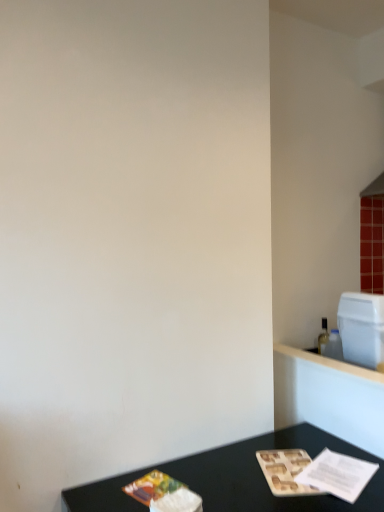
Identify the location of black matte table at lower center. This screenshot has width=384, height=512. (235, 479).

This screenshot has width=384, height=512. What do you see at coordinates (235, 479) in the screenshot? I see `black matte table at lower center` at bounding box center [235, 479].

Describe the element at coordinates (362, 327) in the screenshot. The image size is (384, 512). I see `white plastic container at upper right` at that location.

What is the approximate width of white plastic container at upper right?

29.75 centimeters.

Where is `white plastic container at upper right`? white plastic container at upper right is located at coordinates (362, 327).

At what (x,y) coordinates should I click in order to perform the action: click on black matte table at lower center. Please return your answer as a coordinate pair (x, y). This screenshot has height=512, width=384. Looking at the image, I should click on (235, 479).

Considering the relative positions of black matte table at lower center and white plastic container at upper right in the image provided, is black matte table at lower center to the right of white plastic container at upper right from the viewer's perspective?

Result: Incorrect, black matte table at lower center is not on the right side of white plastic container at upper right.

Considering the relative positions of black matte table at lower center and white plastic container at upper right in the image provided, is black matte table at lower center in front of white plastic container at upper right?

Yes.

Is point (375, 507) closer to viewer compared to point (346, 338)?

Yes, point (375, 507) is closer to viewer.

From the image's perspective, is black matte table at lower center on top of white plastic container at upper right?

No, from the image's perspective, black matte table at lower center is not over white plastic container at upper right.

From a real-world perspective, which is physically above, black matte table at lower center or white plastic container at upper right?

white plastic container at upper right, from a real-world perspective.

Looking at this image, can you confirm if black matte table at lower center is wider than white plastic container at upper right?

Yes, black matte table at lower center is wider than white plastic container at upper right.

Is black matte table at lower center taller or shorter than white plastic container at upper right?

black matte table at lower center is taller than white plastic container at upper right.

In the scene shown: Does black matte table at lower center have a larger size compared to white plastic container at upper right?

Correct, black matte table at lower center is larger in size than white plastic container at upper right.

Is black matte table at lower center located outside white plastic container at upper right?

Yes, black matte table at lower center is not within white plastic container at upper right.

Would you say black matte table at lower center is a long distance from white plastic container at upper right?

That's not correct — black matte table at lower center is a little close to white plastic container at upper right.

Does black matte table at lower center turn towards white plastic container at upper right?

No, black matte table at lower center is not oriented towards white plastic container at upper right.

How many degrees apart are the facing directions of black matte table at lower center and white plastic container at upper right?

There is a 87.7-degree angle between the facing directions of black matte table at lower center and white plastic container at upper right.

How distant is black matte table at lower center from white plastic container at upper right?

black matte table at lower center and white plastic container at upper right are 25.62 inches apart from each other.

The height and width of the screenshot is (512, 384). In order to click on appliance located above the black matte table at lower center (from a real-world perspective) in this screenshot , I will do `click(362, 327)`.

Consider the image. Is white plastic container at upper right at the left side of black matte table at lower center?

No, white plastic container at upper right is not to the left of black matte table at lower center.

Between white plastic container at upper right and black matte table at lower center, which one is positioned behind?

white plastic container at upper right is behind.

Which is less distant, (361, 347) or (352, 509)?

The point (352, 509) is in front.

From the image's perspective, does white plastic container at upper right appear lower than black matte table at lower center?

No.

From a real-world perspective, is white plastic container at upper right physically above black matte table at lower center?

Yes, from a real-world perspective, white plastic container at upper right is on top of black matte table at lower center.

Does white plastic container at upper right have a lesser width compared to black matte table at lower center?

Yes.

Does white plastic container at upper right have a lesser height compared to black matte table at lower center?

Yes, white plastic container at upper right is shorter than black matte table at lower center.

Which of these two, white plastic container at upper right or black matte table at lower center, is smaller?

With smaller size is white plastic container at upper right.

Would you say black matte table at lower center is part of white plastic container at upper right's contents?

No, black matte table at lower center is not surrounded by white plastic container at upper right.

Is white plastic container at upper right far away from black matte table at lower center?

No, white plastic container at upper right is in close proximity to black matte table at lower center.

Is white plastic container at upper right facing away from black matte table at lower center?

No, white plastic container at upper right is not facing away from black matte table at lower center.

Find the location of a particular element. This screenshot has height=512, width=384. table on the left of white plastic container at upper right is located at coordinates [235, 479].

There is a black matte table at lower center. Where is `appliance above it (from a real-world perspective)`? appliance above it (from a real-world perspective) is located at coordinates (362, 327).

Where is `table in front of the white plastic container at upper right`? Image resolution: width=384 pixels, height=512 pixels. table in front of the white plastic container at upper right is located at coordinates (235, 479).